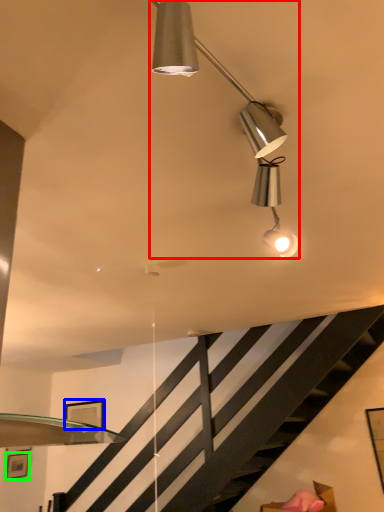
Question: Which is nearer to the lamp (highlighted by a red box)? picture frame (highlighted by a blue box) or picture frame (highlighted by a green box).

Choices:
 (A) picture frame
 (B) picture frame

Answer: (A)